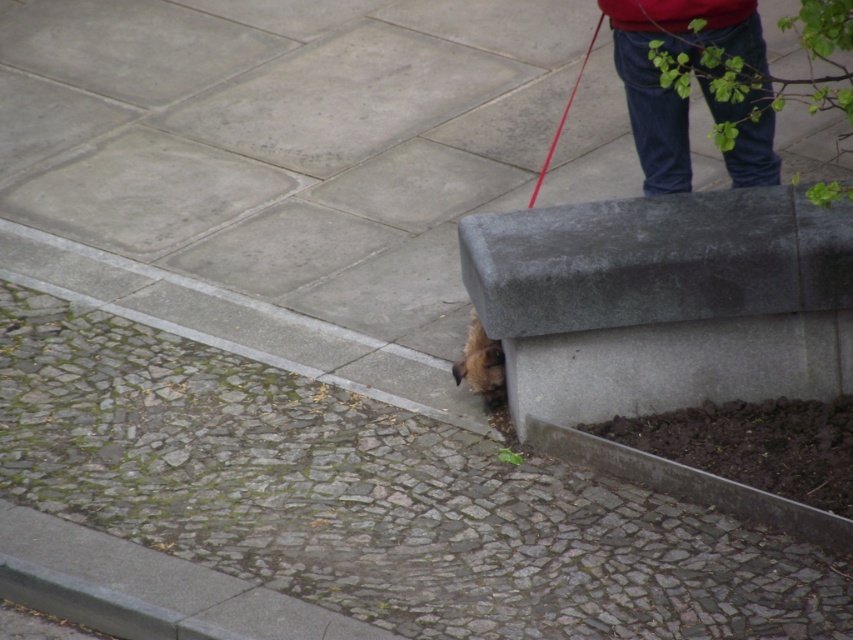
You are a delivery robot with a height of 1.2 meters. You need to deliver a package to the denim pants at upper right while avoiding the brown furry dog at lower center. Can you safely pass between them without bending?

The distance between denim pants at upper right and brown furry dog at lower center is 1.43 meters. Since the robot is 1.2 meters wide, it can pass through the space between them without needing to bend.

You are standing in the outdoor urban scene described. There are two points marked in the image, point (627,51) and point (483,376). Which point is nearer to you?

Point (627,51) is closer to the viewer than point (483,376).